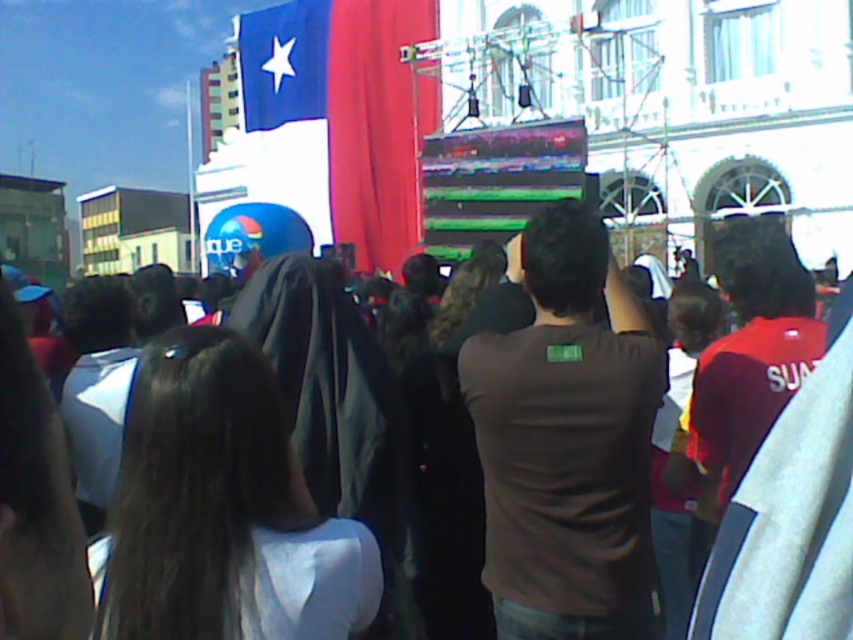
Between brown fabric crowd at center and red fabric flag at center, which one has more height?

Standing taller between the two is red fabric flag at center.

Is the position of brown fabric crowd at center less distant than that of red fabric flag at center?

Yes, brown fabric crowd at center is in front of red fabric flag at center.

Where is `brown fabric crowd at center`? Image resolution: width=853 pixels, height=640 pixels. brown fabric crowd at center is located at coordinates (791, 518).

Between point (548, 624) and point (407, 168), which one is positioned behind?

The point (407, 168) is behind.

Is point (646, 365) positioned in front of point (375, 188)?

Yes, point (646, 365) is closer to viewer.

In the scene shown: Measure the distance between point (550, 269) and camera.

The distance of point (550, 269) from camera is 58.79 meters.

Identify the location of brown matte shirt at center. The width and height of the screenshot is (853, 640). (567, 442).

Can you confirm if brown matte shirt at center is thinner than brown fabric crowd at center?

Yes.

Who is positioned more to the right, brown matte shirt at center or brown fabric crowd at center?

Positioned to the right is brown fabric crowd at center.

At what (x,y) coordinates should I click in order to perform the action: click on brown matte shirt at center. Please return your answer as a coordinate pair (x, y). The height and width of the screenshot is (640, 853). Looking at the image, I should click on (567, 442).